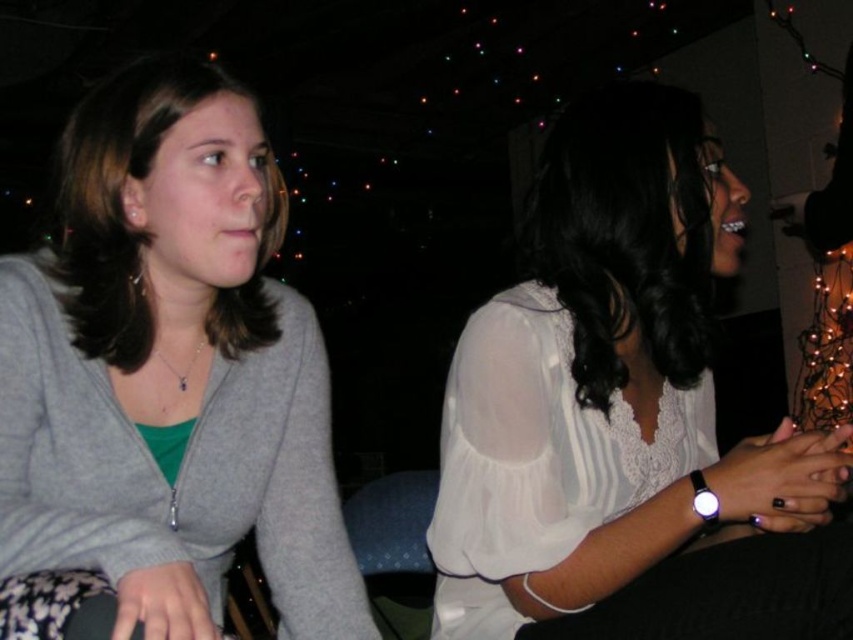
Question: Among these objects, which one is farthest from the camera?

Choices:
 (A) white sheer blouse at center
 (B) matte gray sweater at left

Answer: (A)

Question: Does matte gray sweater at left appear on the right side of white sheer blouse at center?

Choices:
 (A) yes
 (B) no

Answer: (B)

Question: Is matte gray sweater at left positioned behind white sheer blouse at center?

Choices:
 (A) no
 (B) yes

Answer: (A)

Question: Does matte gray sweater at left have a greater width compared to white sheer blouse at center?

Choices:
 (A) yes
 (B) no

Answer: (B)